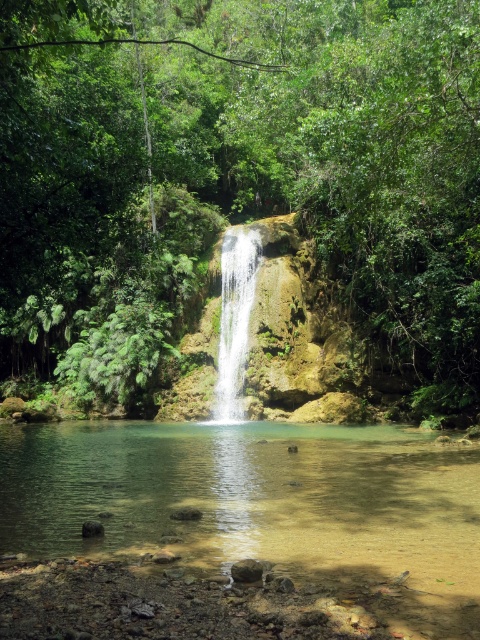
Question: Which object is the farthest from the clear water at center?

Choices:
 (A) green leafy tree at center
 (B) white smooth waterfall at center

Answer: (A)

Question: Which object is farther from the camera taking this photo?

Choices:
 (A) green leafy tree at center
 (B) white smooth waterfall at center
 (C) clear water at center

Answer: (B)

Question: Which point is farther to the camera?

Choices:
 (A) (106, 394)
 (B) (237, 500)
 (C) (222, 362)

Answer: (C)

Question: Does clear water at center appear over white smooth waterfall at center?

Choices:
 (A) yes
 (B) no

Answer: (B)

Question: From the image, what is the correct spatial relationship of green leafy tree at center in relation to white smooth waterfall at center?

Choices:
 (A) left
 (B) right

Answer: (A)

Question: Can you confirm if green leafy tree at center is smaller than clear water at center?

Choices:
 (A) yes
 (B) no

Answer: (B)